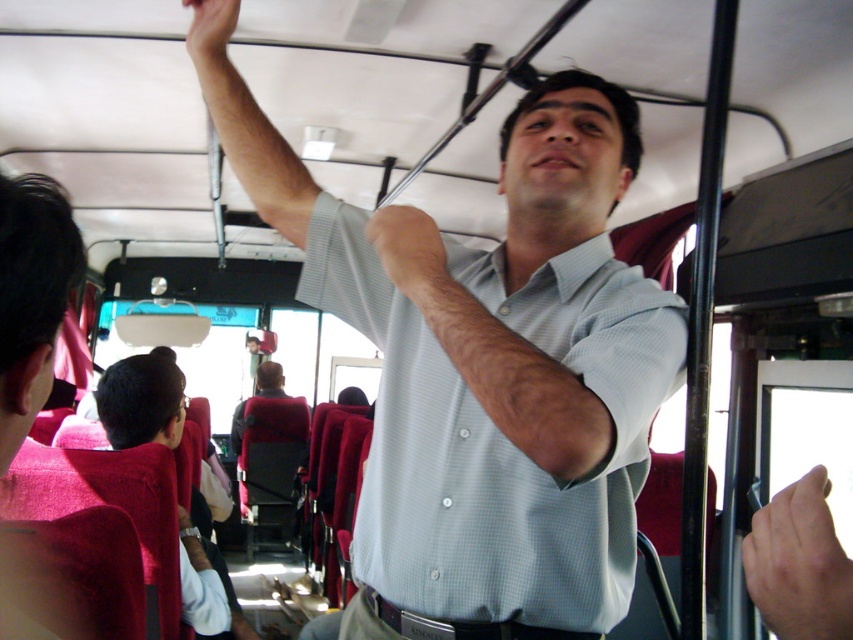
You are a passenger on the bus and want to reach your bag placed on the luggage rack above your seat. There is a smooth skin hand at upper right and a light gray shirt at center in your view. Which object is closer to you?

The smooth skin hand at upper right is closer to you because it is in front of the light gray shirt at center.

You are a passenger on a public bus and notice two items in your view. The first is a smooth skin hand at upper right, and the second is a light gray shirt at center. Which of these two items is positioned more to the right side of your view?

The smooth skin hand at upper right is positioned more to the right side of your view because it is located to the right of the light gray shirt at center.